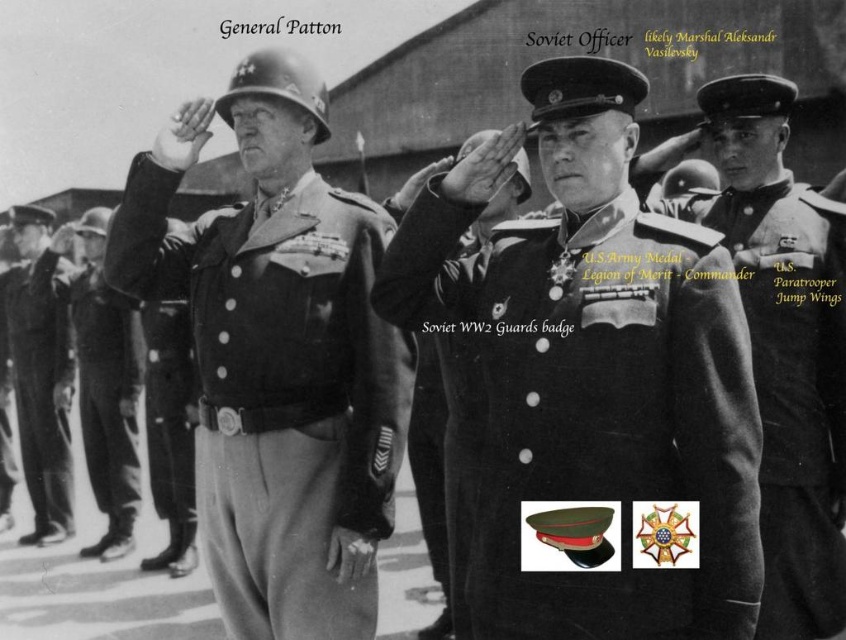
Question: Does dark gray wool military uniform at center have a larger size compared to matte black uniform at center?

Choices:
 (A) no
 (B) yes

Answer: (A)

Question: Which point is farther to the camera?

Choices:
 (A) dark gray wool military uniform at center
 (B) dark uniform at center
 (C) smooth black uniform at center
 (D) matte black helmet at center

Answer: (C)

Question: Which object is closer to the camera taking this photo?

Choices:
 (A) dark gray wool military uniform at center
 (B) matte black helmet at center

Answer: (B)

Question: Can you confirm if dark uniform at center is positioned to the left of smooth black uniform at center?

Choices:
 (A) yes
 (B) no

Answer: (B)

Question: Which point is closer to the camera?

Choices:
 (A) dark gray wool military uniform at center
 (B) matte black helmet at center
 (C) matte black uniform at center
 (D) dark uniform at center

Answer: (D)

Question: Where is dark uniform at center located in relation to matte black helmet at center in the image?

Choices:
 (A) below
 (B) above

Answer: (A)